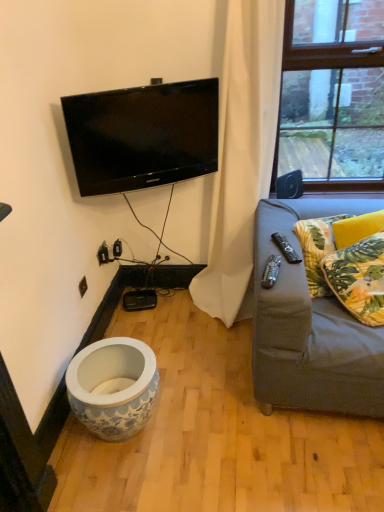
The height and width of the screenshot is (512, 384). What are the coordinates of `free space above yellow floral fabric pillow at right, marked as the first pillow in a back-to-front arrangement (from a real-world perspective)` in the screenshot? It's located at (347, 216).